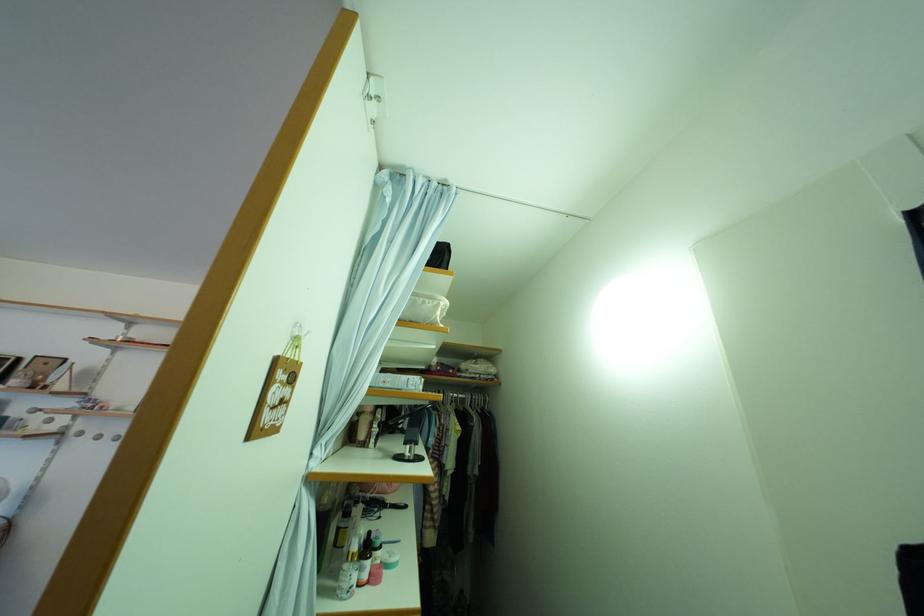
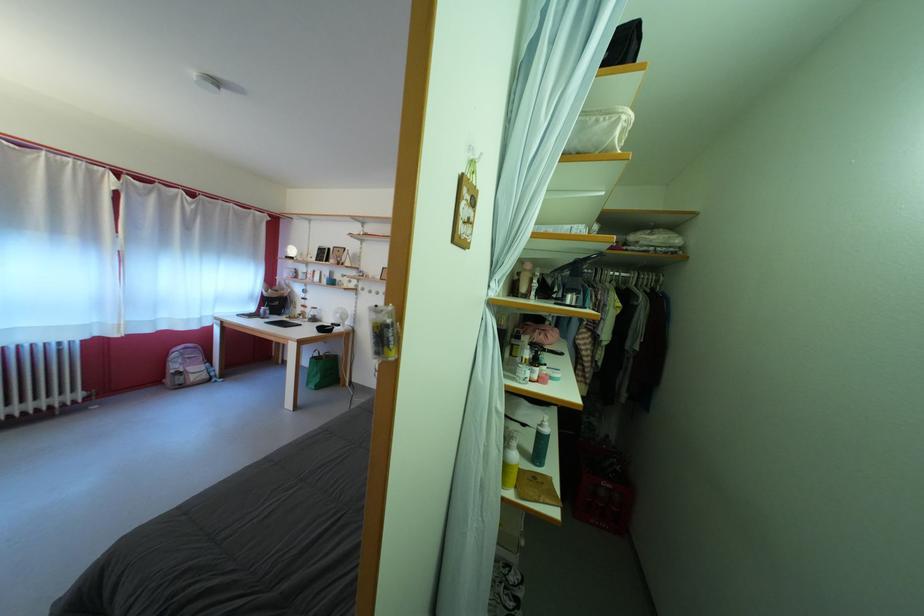
Where in the second image is the point corresponding to point (432, 309) from the first image?

(605, 128)